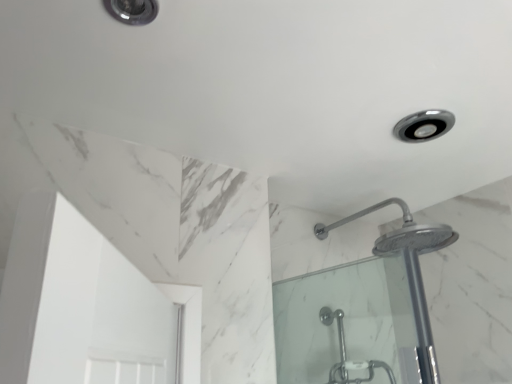
Question: Relative to satin nickel light fixture at upper right, the 2th light fixture in the left-to-right sequence, is polished chrome shower head at upper right in front or behind?

Choices:
 (A) behind
 (B) front

Answer: (B)

Question: From the image's perspective, relative to satin nickel light fixture at upper right, which appears as the 1th light fixture when viewed from the right, is polished chrome shower head at upper right above or below?

Choices:
 (A) below
 (B) above

Answer: (A)

Question: Considering the real-world distances, which object is farthest from the satin nickel light fixture at upper right, arranged as the first light fixture when viewed from the back?

Choices:
 (A) polished chrome shower head at upper right
 (B) matte silver light fixture at upper left, the second light fixture positioned from the bottom

Answer: (B)

Question: Which object is positioned farthest from the polished chrome shower head at upper right?

Choices:
 (A) matte silver light fixture at upper left, placed as the 1th light fixture when sorted from left to right
 (B) satin nickel light fixture at upper right, the 2th light fixture in the left-to-right sequence

Answer: (A)